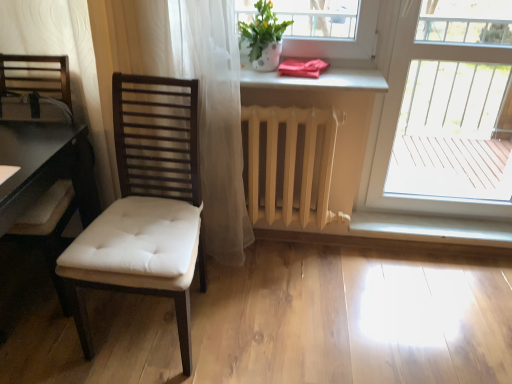
Question: From the image's perspective, is red satin towel at upper center on transparent glass door at right?

Choices:
 (A) yes
 (B) no

Answer: (A)

Question: Is red satin towel at upper center to the right of transparent glass door at right from the viewer's perspective?

Choices:
 (A) yes
 (B) no

Answer: (B)

Question: Is red satin towel at upper center positioned with its back to transparent glass door at right?

Choices:
 (A) yes
 (B) no

Answer: (B)

Question: Can you confirm if red satin towel at upper center is smaller than transparent glass door at right?

Choices:
 (A) no
 (B) yes

Answer: (B)

Question: From a real-world perspective, is red satin towel at upper center over transparent glass door at right?

Choices:
 (A) yes
 (B) no

Answer: (A)

Question: Does red satin towel at upper center have a greater height compared to transparent glass door at right?

Choices:
 (A) yes
 (B) no

Answer: (B)

Question: From a real-world perspective, is matte white pot at upper center located beneath transparent glass door at right?

Choices:
 (A) no
 (B) yes

Answer: (A)

Question: Does matte white pot at upper center appear on the left side of transparent glass door at right?

Choices:
 (A) yes
 (B) no

Answer: (A)

Question: Is transparent glass door at right at the back of matte white pot at upper center?

Choices:
 (A) yes
 (B) no

Answer: (B)

Question: Does matte white pot at upper center have a greater height compared to transparent glass door at right?

Choices:
 (A) no
 (B) yes

Answer: (A)

Question: Does matte white pot at upper center lie behind transparent glass door at right?

Choices:
 (A) no
 (B) yes

Answer: (B)

Question: From the image's perspective, does matte white pot at upper center appear lower than transparent glass door at right?

Choices:
 (A) yes
 (B) no

Answer: (B)

Question: Is white glossy window sill at lower center positioned with its back to white matte radiator at center?

Choices:
 (A) no
 (B) yes

Answer: (A)